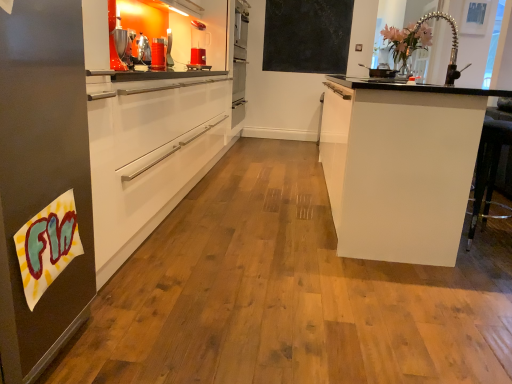
Question: Does metallic silver coffee machine at upper left have a lesser height compared to white glossy cabinet at right?

Choices:
 (A) no
 (B) yes

Answer: (B)

Question: From a real-world perspective, is metallic silver coffee machine at upper left physically below white glossy cabinet at right?

Choices:
 (A) yes
 (B) no

Answer: (B)

Question: Does metallic silver coffee machine at upper left have a larger size compared to white glossy cabinet at right?

Choices:
 (A) yes
 (B) no

Answer: (B)

Question: Does metallic silver coffee machine at upper left lie behind white glossy cabinet at right?

Choices:
 (A) yes
 (B) no

Answer: (A)

Question: Is the position of metallic silver coffee machine at upper left less distant than that of white glossy cabinet at right?

Choices:
 (A) yes
 (B) no

Answer: (B)

Question: From their relative heights in the image, would you say white glossy cabinet at right is taller or shorter than matte black chalkboard at upper center?

Choices:
 (A) short
 (B) tall

Answer: (A)

Question: Is point (434, 147) closer or farther from the camera than point (293, 21)?

Choices:
 (A) closer
 (B) farther

Answer: (A)

Question: Relative to matte black chalkboard at upper center, is white glossy cabinet at right in front or behind?

Choices:
 (A) front
 (B) behind

Answer: (A)

Question: Considering the positions of white glossy cabinet at right and matte black chalkboard at upper center in the image, is white glossy cabinet at right wider or thinner than matte black chalkboard at upper center?

Choices:
 (A) wide
 (B) thin

Answer: (A)

Question: Is point (305, 29) positioned closer to the camera than point (337, 117)?

Choices:
 (A) closer
 (B) farther

Answer: (B)

Question: Is matte black chalkboard at upper center wider or thinner than white glossy cabinet at right?

Choices:
 (A) wide
 (B) thin

Answer: (B)

Question: From a real-world perspective, is matte black chalkboard at upper center above or below white glossy cabinet at right?

Choices:
 (A) above
 (B) below

Answer: (A)

Question: Based on their sizes in the image, would you say matte black chalkboard at upper center is bigger or smaller than white glossy cabinet at right?

Choices:
 (A) small
 (B) big

Answer: (A)

Question: From the image's perspective, is translucent plastic pitcher at center above or below matte black chalkboard at upper center?

Choices:
 (A) above
 (B) below

Answer: (B)

Question: Looking at their shapes, would you say translucent plastic pitcher at center is wider or thinner than matte black chalkboard at upper center?

Choices:
 (A) thin
 (B) wide

Answer: (B)